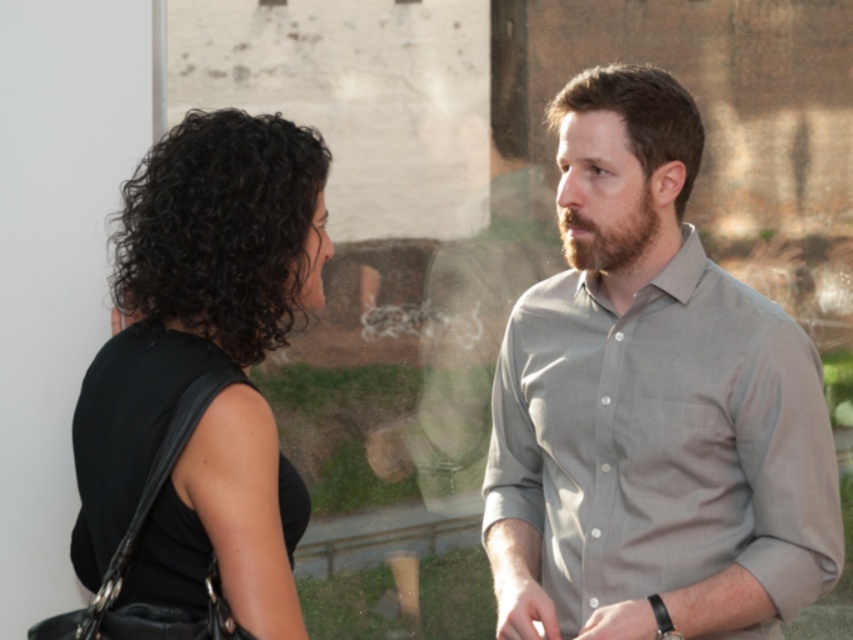
Which is below, black matte dress at left or brownwoollybeard at right?

black matte dress at left is below.

Between point (263, 426) and point (630, 218), which one is positioned in front?

Point (263, 426)

Describe the element at coordinates (193, 292) in the screenshot. The width and height of the screenshot is (853, 640). I see `black matte dress at left` at that location.

This screenshot has height=640, width=853. What are the coordinates of `black matte dress at left` in the screenshot? It's located at (193, 292).

Who is positioned more to the right, gray cotton shirt at right or brownwoollybeard at right?

Positioned to the right is gray cotton shirt at right.

Is gray cotton shirt at right further to camera compared to brownwoollybeard at right?

No, it is not.

What do you see at coordinates (653, 412) in the screenshot? I see `gray cotton shirt at right` at bounding box center [653, 412].

Find the location of `gray cotton shirt at right`. gray cotton shirt at right is located at coordinates point(653,412).

Who is positioned more to the right, gray cotton shirt at right or black matte dress at left?

gray cotton shirt at right is more to the right.

Consider the image. Is gray cotton shirt at right positioned before black matte dress at left?

No, gray cotton shirt at right is further to the viewer.

Is point (682, 630) positioned before point (135, 230)?

That is False.

Where is `gray cotton shirt at right`? Image resolution: width=853 pixels, height=640 pixels. gray cotton shirt at right is located at coordinates (653, 412).